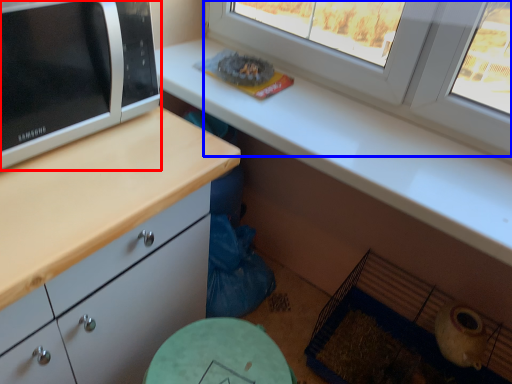
Question: Which of the following is the farthest to the observer, microwave oven (highlighted by a red box) or window (highlighted by a blue box)?

Choices:
 (A) microwave oven
 (B) window

Answer: (B)